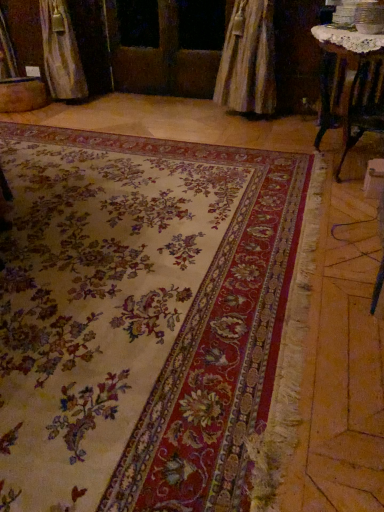
Question: Looking at their shapes, would you say wooden table at upper right is wider or thinner than floral carpet at center?

Choices:
 (A) thin
 (B) wide

Answer: (A)

Question: Is wooden table at upper right bigger or smaller than floral carpet at center?

Choices:
 (A) small
 (B) big

Answer: (A)

Question: Estimate the real-world distances between objects in this image. Which object is closer to the floral carpet at center?

Choices:
 (A) wooden table at upper right
 (B) wooden screen door at center

Answer: (A)

Question: Which object is the farthest from the wooden table at upper right?

Choices:
 (A) floral carpet at center
 (B) wooden screen door at center

Answer: (B)